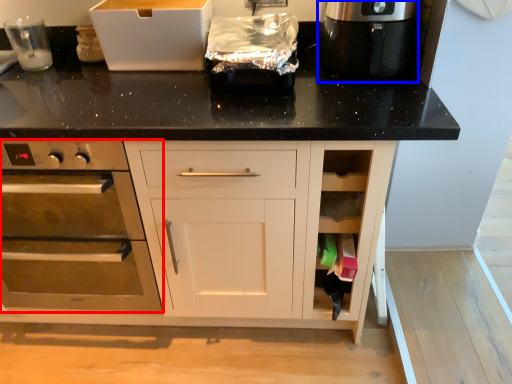
Question: Which object is further to the camera taking this photo, home appliance (highlighted by a red box) or kitchen appliance (highlighted by a blue box)?

Choices:
 (A) home appliance
 (B) kitchen appliance

Answer: (B)